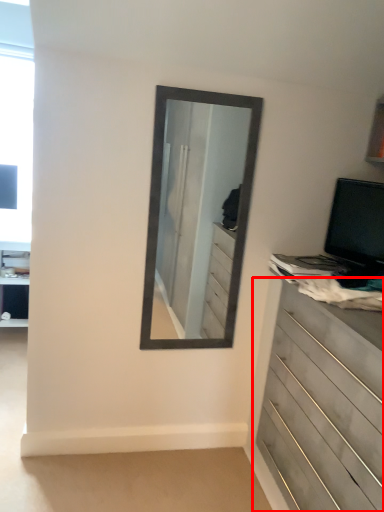
Question: From the image's perspective, what is the correct spatial relationship of chest of drawers (annotated by the red box) in relation to computer monitor?

Choices:
 (A) below
 (B) above

Answer: (A)